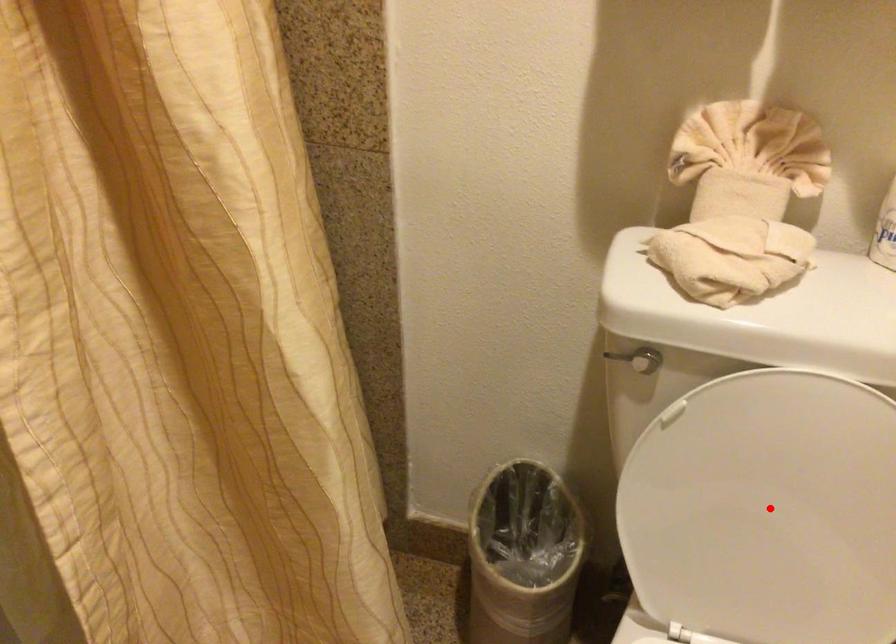
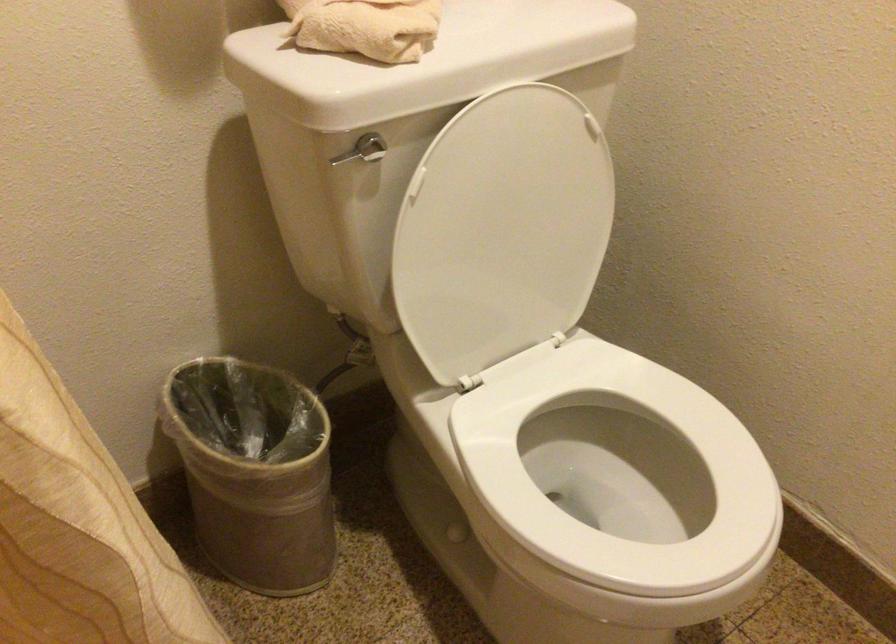
Where in the second image is the point corresponding to the highlighted location from the first image?

(502, 230)